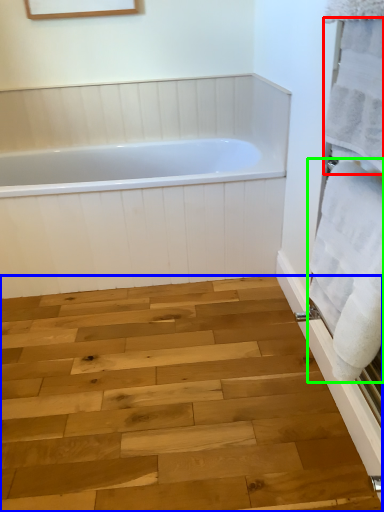
Question: Which is farther away from bath towel (highlighted by a red box)? plank (highlighted by a blue box) or bath towel (highlighted by a green box)?

Choices:
 (A) plank
 (B) bath towel

Answer: (A)